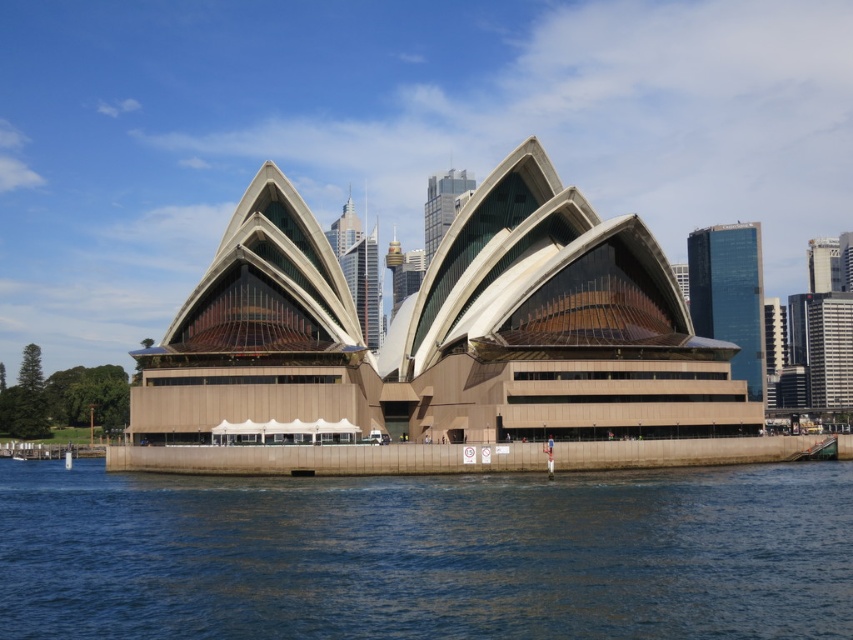
Question: Does blue water at lower center appear on the left side of beige concrete opera house at center?

Choices:
 (A) yes
 (B) no

Answer: (B)

Question: Among these points, which one is farthest from the camera?

Choices:
 (A) (175, 573)
 (B) (263, 192)

Answer: (B)

Question: Does blue water at lower center appear over beige concrete opera house at center?

Choices:
 (A) yes
 (B) no

Answer: (B)

Question: Which point is closer to the camera?

Choices:
 (A) blue water at lower center
 (B) beige concrete opera house at center

Answer: (A)

Question: Is blue water at lower center in front of beige concrete opera house at center?

Choices:
 (A) no
 (B) yes

Answer: (B)